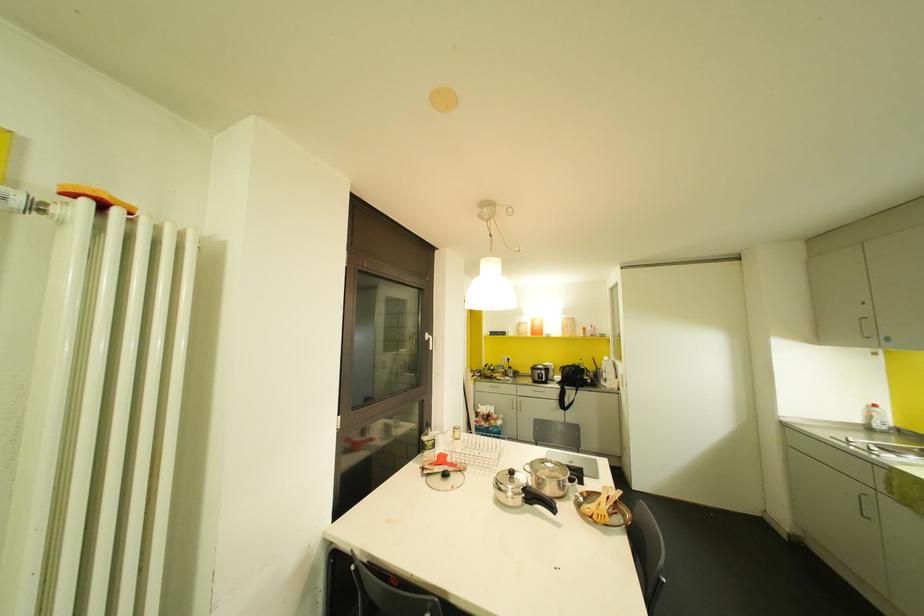
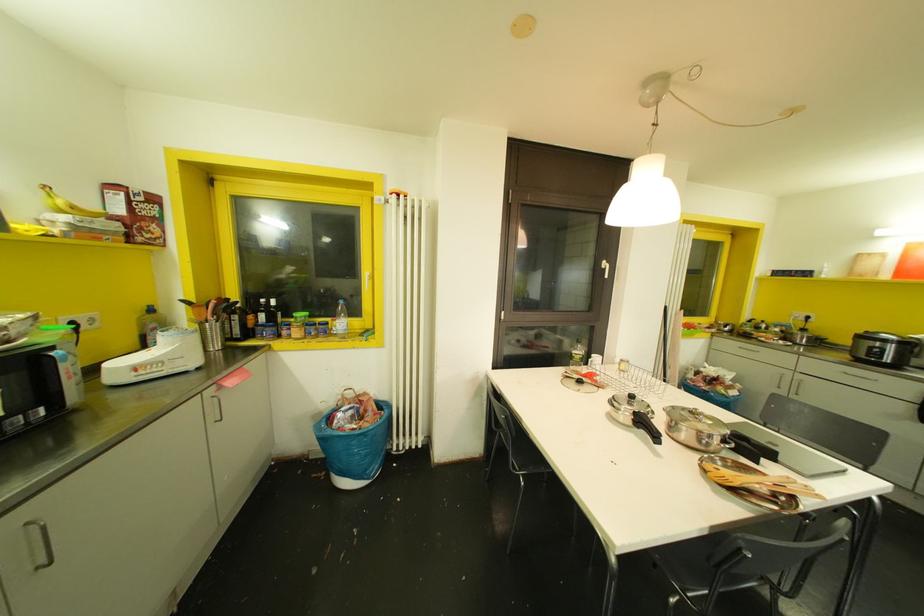
Locate, in the second image, the point that corresponds to [532,368] in the first image.

(861, 336)